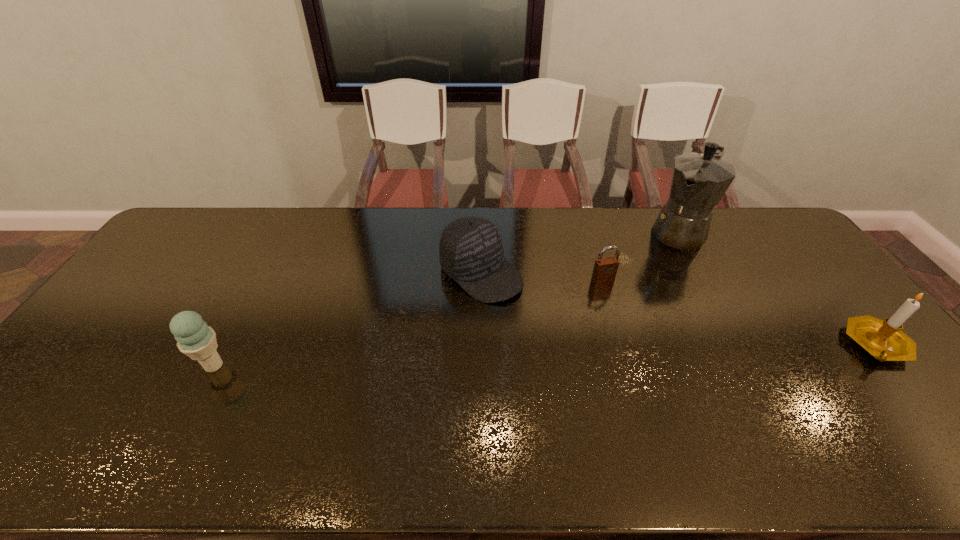
Where is `free space located 0.320m on the front-facing side of the shortest object`? free space located 0.320m on the front-facing side of the shortest object is located at coordinates (659, 367).

Find the location of a particular element. free space located on the front-facing side of the shortest object is located at coordinates (635, 330).

You are a GUI agent. You are given a task and a screenshot of the screen. Output one action in this format:
    pyautogui.click(x=<x>, y=<y>)
    Task: Click on the free location located 0.120m on the pouring side of the tallest object
    The image size is (960, 540).
    Given the screenshot: What is the action you would take?
    pyautogui.click(x=655, y=265)

Identify the location of free region located 0.230m on the pouring side of the tallest object. The width and height of the screenshot is (960, 540). (640, 283).

At what (x,y) coordinates should I click in order to perform the action: click on vacant space situated on the pouring side of the tallest object. Please return your answer as a coordinate pair (x, y). Image resolution: width=960 pixels, height=540 pixels. Looking at the image, I should click on (626, 301).

The width and height of the screenshot is (960, 540). Identify the location of free location located at the front of the baseball cap where the brim is located. (609, 374).

This screenshot has width=960, height=540. What are the coordinates of `free spot located 0.090m at the front of the baseball cap where the brim is located` in the screenshot? It's located at (531, 313).

I want to click on vacant space located 0.160m at the front of the baseball cap where the brim is located, so [x=548, y=327].

I want to click on coffeepot located at the far edge, so click(698, 182).

Identify the location of baseball cap present at the far edge. The height and width of the screenshot is (540, 960). (471, 252).